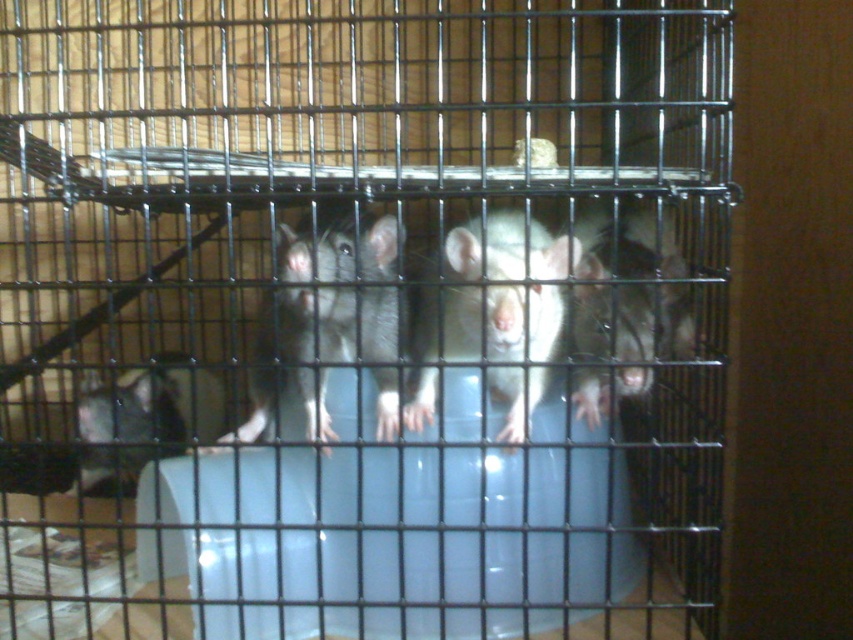
Is gray matte rat at center below white matte rat at center?

Correct, gray matte rat at center is located below white matte rat at center.

Does gray matte rat at center appear on the right side of white matte rat at center?

In fact, gray matte rat at center is to the left of white matte rat at center.

Find the location of `gray matte rat at center`. gray matte rat at center is located at coordinates (323, 314).

Does gray matte rat at center appear under white matte mouse at center?

Yes.

Between gray matte rat at center and white matte mouse at center, which one is positioned lower?

Positioned lower is gray matte rat at center.

This screenshot has height=640, width=853. Describe the element at coordinates (323, 314) in the screenshot. I see `gray matte rat at center` at that location.

Identify the location of gray matte rat at center. (323, 314).

Between white matte mouse at center and white matte rat at center, which one appears on the right side from the viewer's perspective?

white matte rat at center is more to the right.

Is white matte mouse at center smaller than white matte rat at center?

Yes, white matte mouse at center is smaller than white matte rat at center.

You are a GUI agent. You are given a task and a screenshot of the screen. Output one action in this format:
    pyautogui.click(x=<x>, y=<y>)
    Task: Click on the white matte mouse at center
    
    Given the screenshot: What is the action you would take?
    pyautogui.click(x=488, y=346)